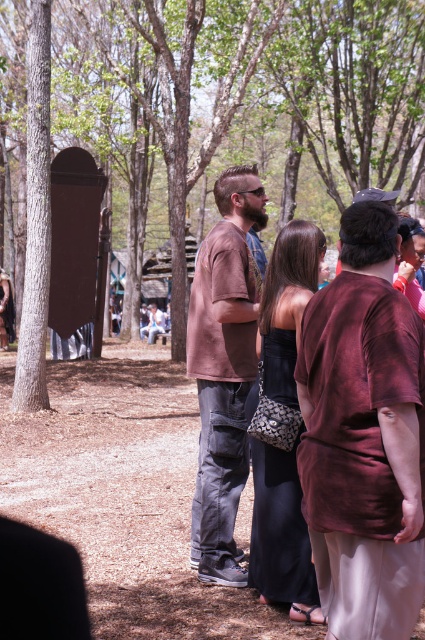
Which of these two, brown bark tree at center or brown cotton shirt at center, stands taller?

Standing taller between the two is brown bark tree at center.

Can you confirm if brown bark tree at center is positioned to the right of brown cotton shirt at center?

In fact, brown bark tree at center is to the left of brown cotton shirt at center.

Does point (82, 42) lie behind point (203, 452)?

That is True.

The width and height of the screenshot is (425, 640). What are the coordinates of `brown bark tree at center` in the screenshot? It's located at (357, 90).